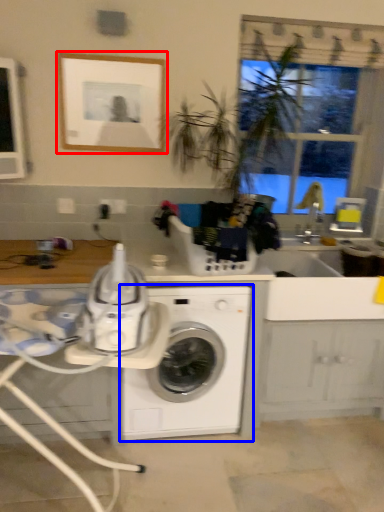
Question: Which object appears closest to the camera in this image, picture frame (highlighted by a red box) or washing machine (highlighted by a blue box)?

Choices:
 (A) picture frame
 (B) washing machine

Answer: (B)